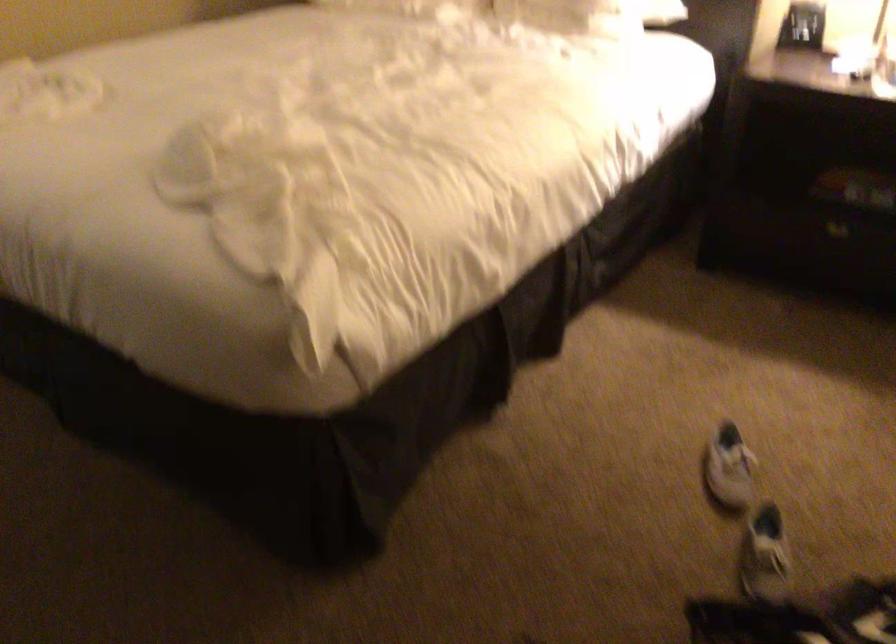
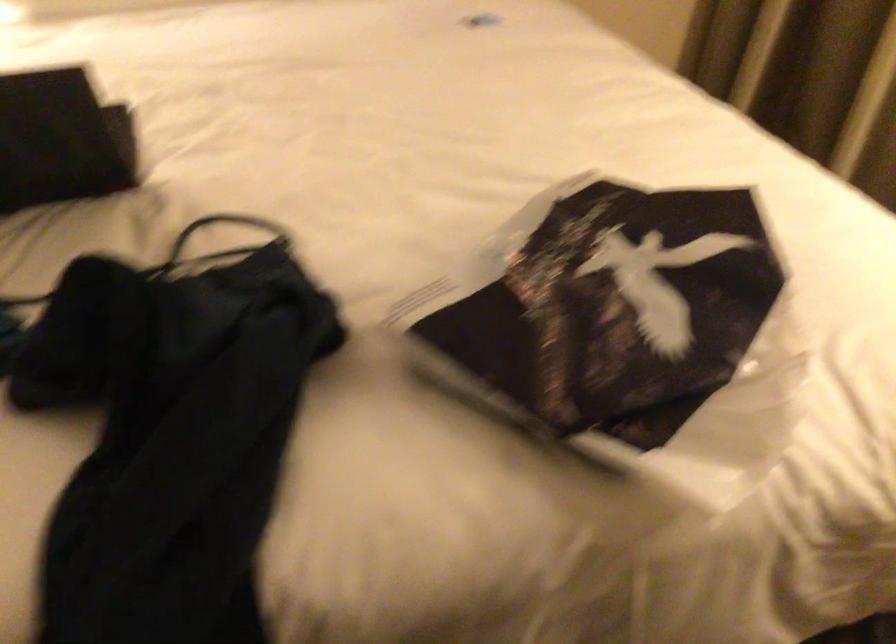
Question: The first image is from the beginning of the video and the second image is from the end. How did the camera likely rotate when shooting the video?

Choices:
 (A) Left
 (B) Right
 (C) Up
 (D) Down

Answer: (B)